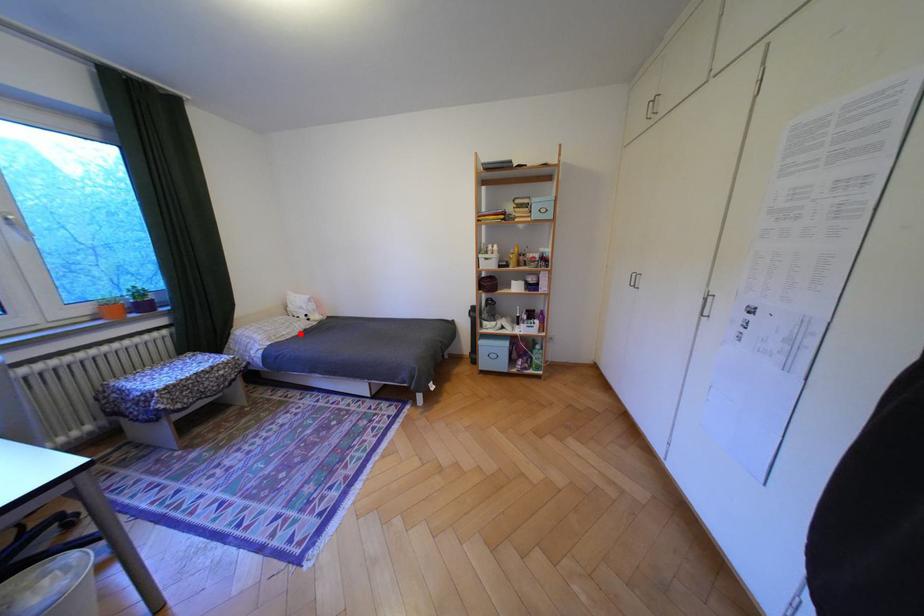
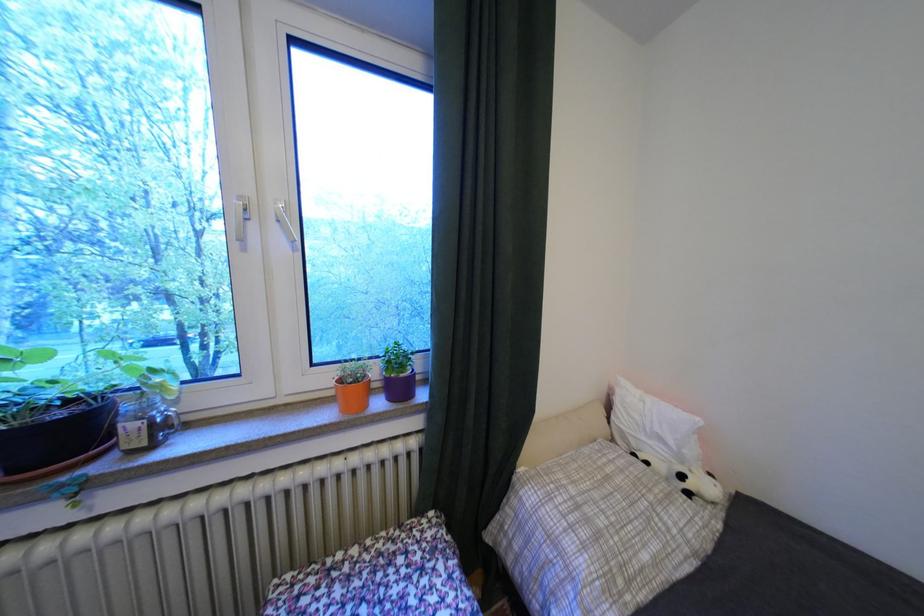
Locate, in the second image, the point that corresponds to the highlighted location in the first image.

(667, 562)